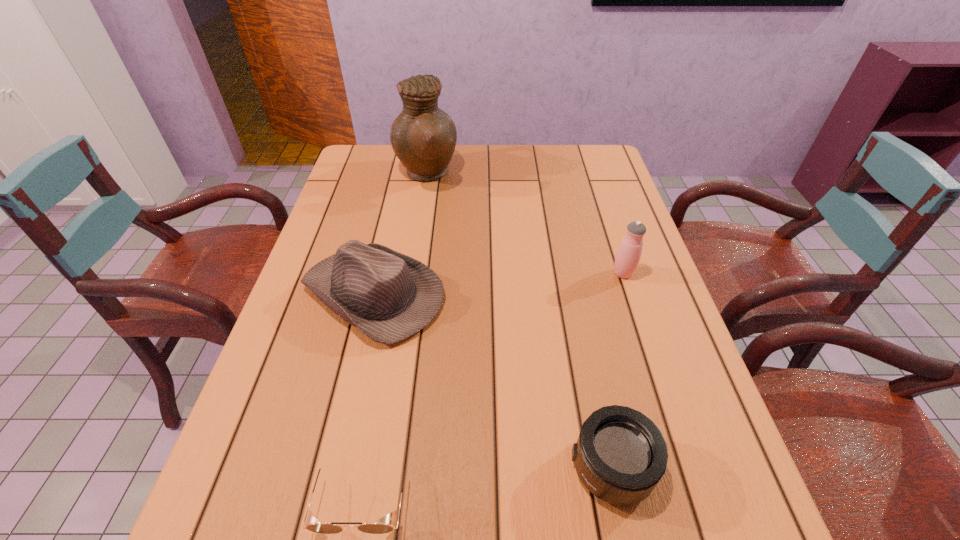
Find the location of a particular element. object that is positioned at the far left corner is located at coordinates (423, 137).

You are a GUI agent. You are given a task and a screenshot of the screen. Output one action in this format:
    pyautogui.click(x=<x>, y=<y>)
    Task: Click on the vacant area at the far edge
    The image size is (960, 540).
    Given the screenshot: What is the action you would take?
    pyautogui.click(x=410, y=179)

I want to click on vacant space at the left edge of the desktop, so click(x=321, y=417).

Identify the location of vacant space at the right edge. (637, 344).

Find the location of a particular element. This screenshot has width=960, height=540. vacant space at the near right corner of the desktop is located at coordinates (746, 530).

Find the location of a particular element. empty space that is in between the fourth shortest object and the sunglasses is located at coordinates (493, 385).

The image size is (960, 540). In order to click on free spot between the farthest object and the thermos bottle in this screenshot , I will do `click(524, 224)`.

Find the location of a particular element. empty space between the farthest object and the second tallest object is located at coordinates (524, 224).

This screenshot has height=540, width=960. Find the location of `free space between the rightmost object and the second object from right to left`. free space between the rightmost object and the second object from right to left is located at coordinates (617, 370).

This screenshot has width=960, height=540. Identify the location of free spot between the thermos bottle and the telephoto lens. (617, 370).